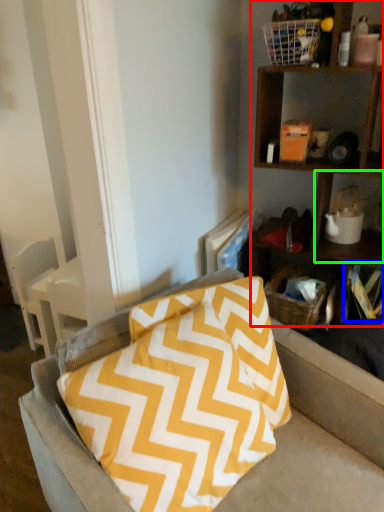
Question: Which object is positioned farthest from shelf (highlighted by a red box)? Select from book (highlighted by a blue box) and cabinet (highlighted by a green box).

Choices:
 (A) book
 (B) cabinet

Answer: (A)